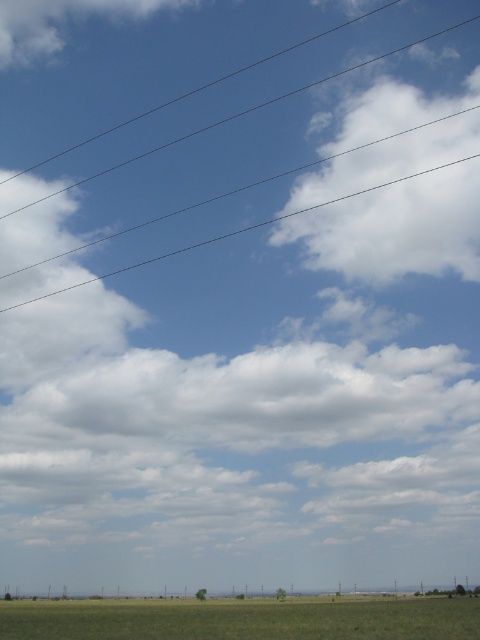
You are standing in the green grassland at lower center and looking up at the sky. Which direction should you turn to see the white fluffy cloud at center?

You should turn to your left to see the white fluffy cloud at center because it is located to the left of the green grassland at lower center.

You are standing in the middle of the field and want to take a photo of the white fluffy cloud at upper right. To ensure the cloud is centered in your camera viewfinder, where should you aim your camera? Use the 2D coordinates provided to describe the direction.

You should aim your camera towards the coordinates point (396, 230) to center the white fluffy cloud at upper right in your viewfinder.

You are standing in the middle of the grassy field and want to point to the white fluffy cloud at center. What coordinates should you aim for?

You should aim for the coordinates point at (252,396) to point at the white fluffy cloud at center.